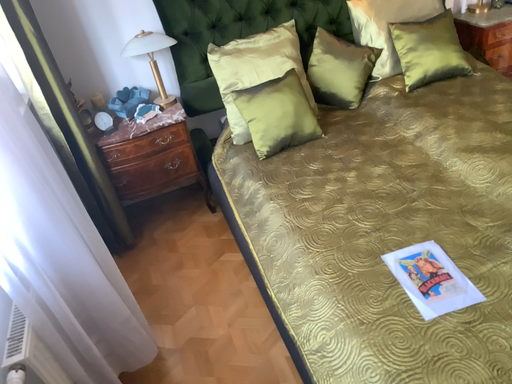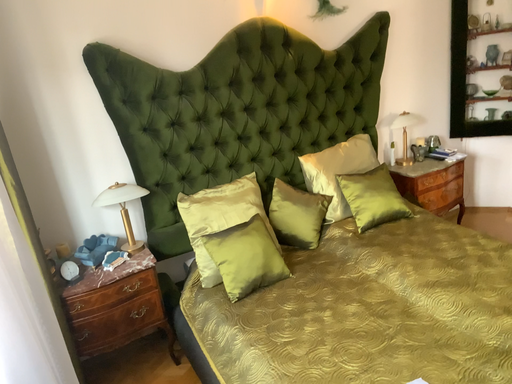
Question: How did the camera likely rotate when shooting the video?

Choices:
 (A) rotated upward
 (B) rotated downward

Answer: (A)